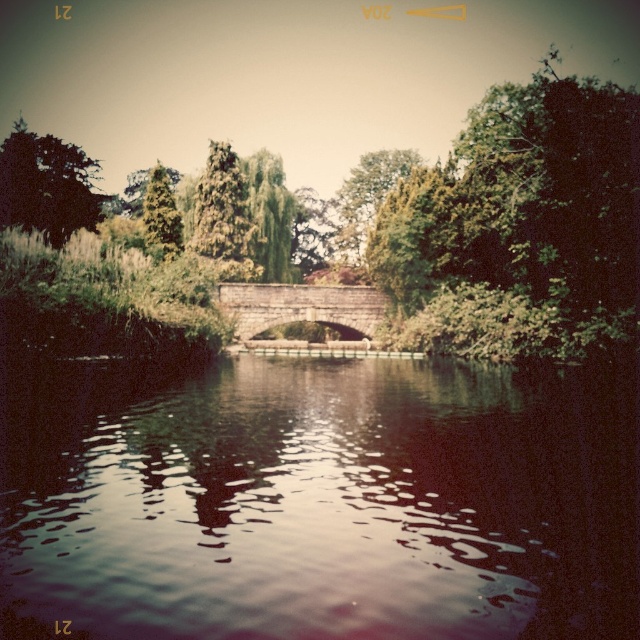
You are standing at the stone bridge in the middle ground of the scene. You spot two points marked in the image. Which point is nearer to you, point (296, 470) or point (24, 186)?

Point (296, 470) is closer to the viewer than point (24, 186).

You are standing on the stone bridge in the middle ground and want to know if the dark reflective water at center is shorter than the green textured tree at upper left. Can you confirm this based on the scene?

Yes, the dark reflective water at center is shorter than the green textured tree at upper left according to the scene description.